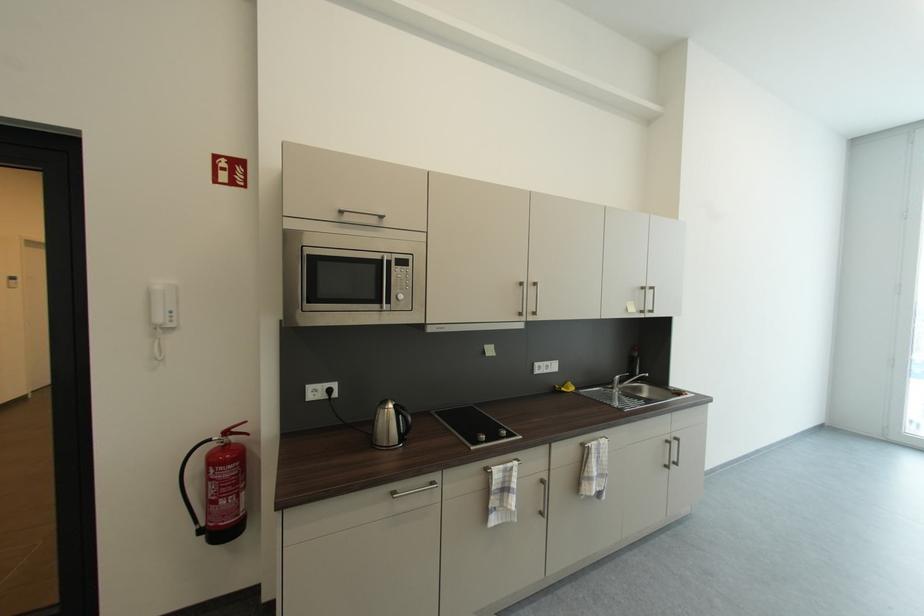
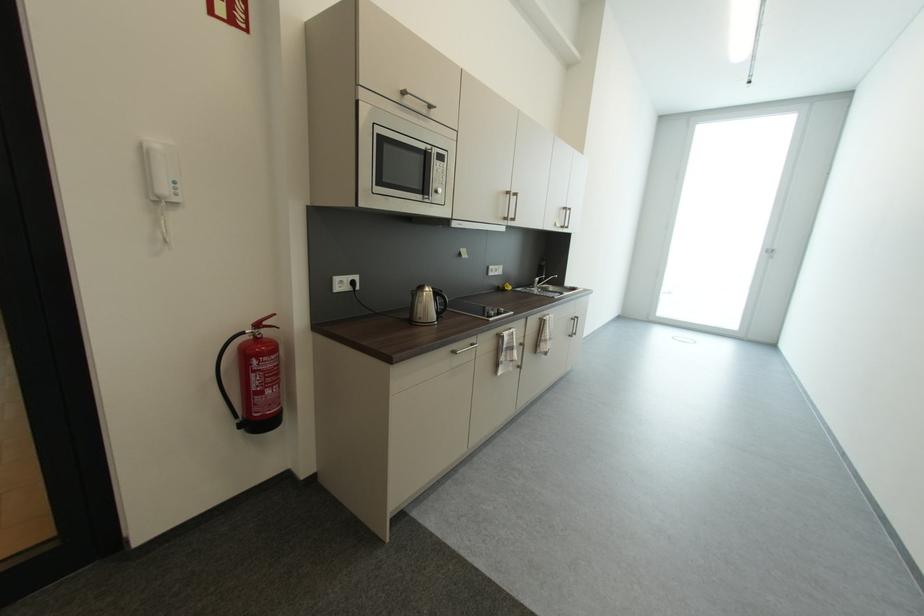
Question: In a continuous first-person perspective shot, in which direction is the camera moving?

Choices:
 (A) Left
 (B) Right
 (C) Forward
 (D) Backward

Answer: (A)